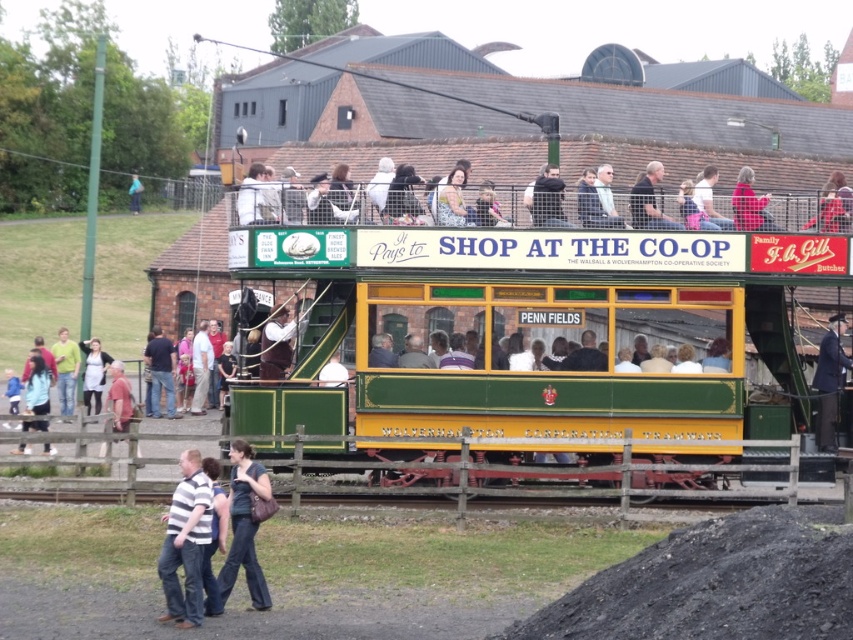
You are a tour guide leading a group of visitors to the vintage tram at the heritage tramway event. You need to inform them about the distance between the green wooden train at center and the dark blue fabric purse at lower center. What do you tell them?

The green wooden train at center is 9.24 meters away from the dark blue fabric purse at lower center.

You are standing at the entrance of the tramway event and see the green wooden train at center. If you want to take a photo of it from the front, where should you position yourself relative to the train?

To take a photo of the green wooden train at center from the front, you should position yourself directly in front of the train, which is at the point with coordinates 0.533 on the x and 0.631 on the y axis.